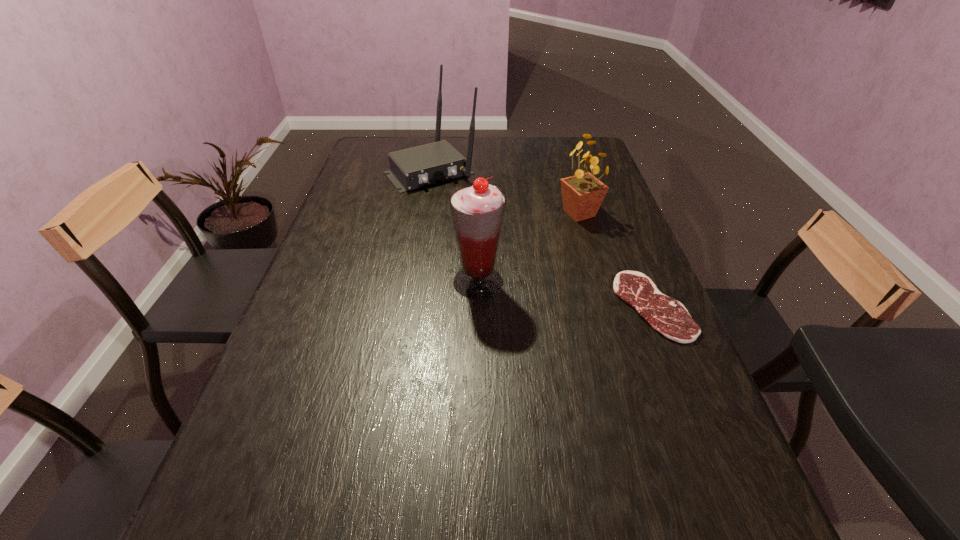
Image resolution: width=960 pixels, height=540 pixels. I want to click on vacant space on the desktop that is between the smoothie and the steak and is positioned on the back of the farthest object to connect cables, so click(x=545, y=291).

Where is `vacant space on the desktop that is between the smoothie and the steak and is positioned at the front of the second shortest object with flowers visible`? The height and width of the screenshot is (540, 960). vacant space on the desktop that is between the smoothie and the steak and is positioned at the front of the second shortest object with flowers visible is located at coordinates (550, 292).